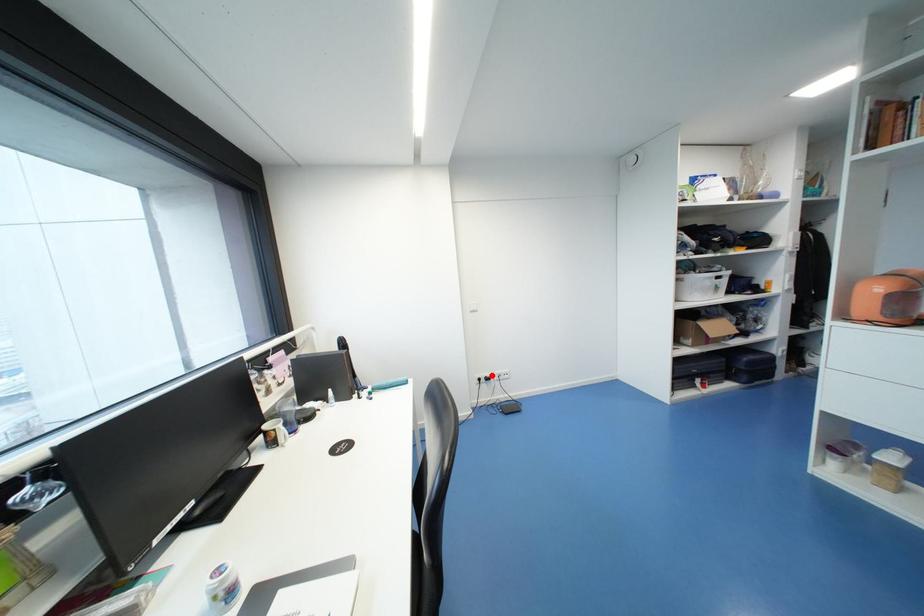
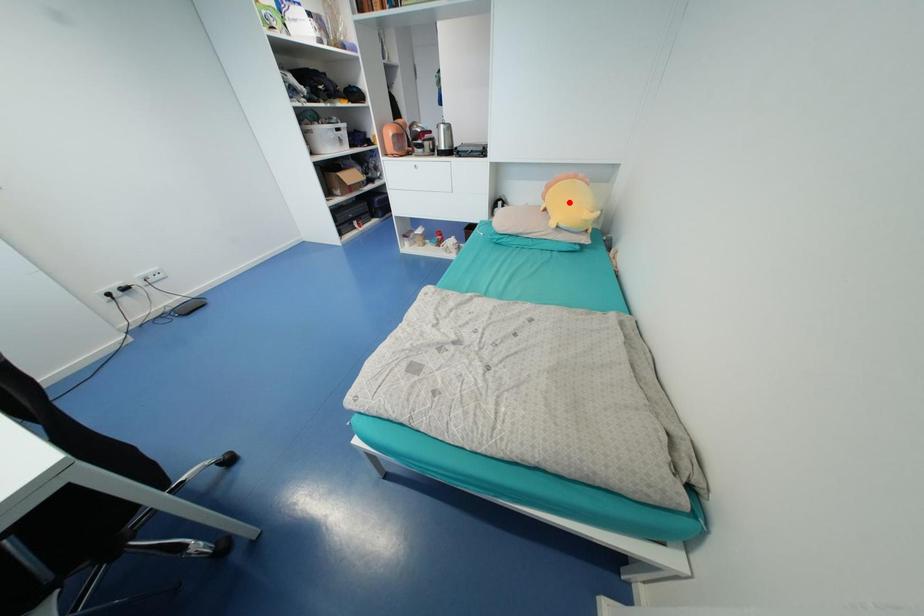
I am providing you with two images of the same scene from different viewpoints. A red point is marked on the first image and another point is marked on the second image. Are the points marked in image1 and image2 representing the same 3D position?

No